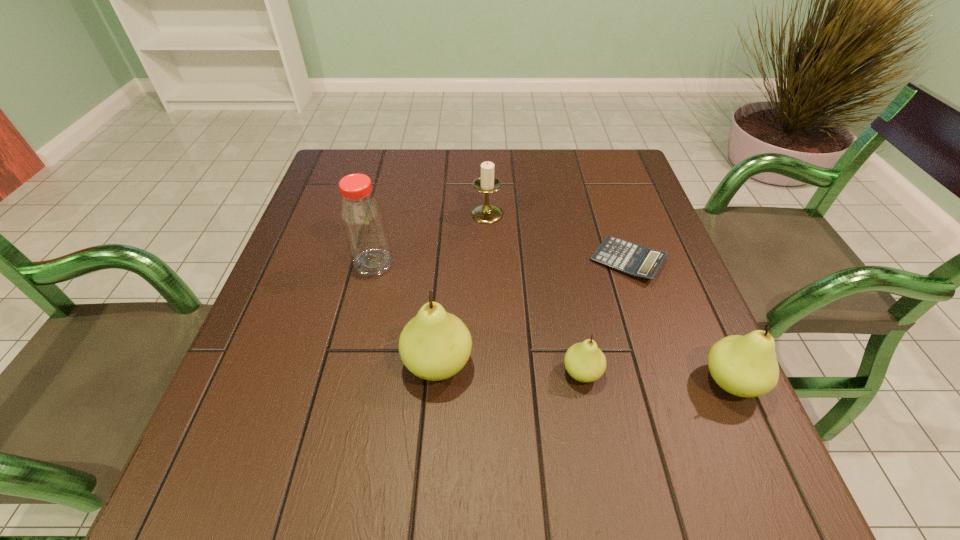
At what (x,y) coordinates should I click in order to perform the action: click on free spot located on the front of the candle holder. Please return your answer as a coordinate pair (x, y). This screenshot has height=540, width=960. Looking at the image, I should click on (488, 301).

The width and height of the screenshot is (960, 540). I want to click on free space located on the back of the shortest object, so click(x=594, y=161).

Find the location of `vacant space located on the back of the bottle`. vacant space located on the back of the bottle is located at coordinates (397, 164).

At what (x,y) coordinates should I click in order to perform the action: click on object present at the left edge. Please return your answer as a coordinate pair (x, y). Looking at the image, I should click on (363, 220).

The image size is (960, 540). What are the coordinates of `pear that is at the right edge` in the screenshot? It's located at (746, 366).

Where is `calculator that is at the right edge`? calculator that is at the right edge is located at coordinates (638, 261).

Where is `object positioned at the near right corner`? This screenshot has height=540, width=960. object positioned at the near right corner is located at coordinates (746, 366).

The width and height of the screenshot is (960, 540). In the image, there is a desktop. Identify the location of vacant space at the far edge. (406, 163).

Identify the location of free space at the near edge of the desktop. The width and height of the screenshot is (960, 540). (491, 395).

You are a GUI agent. You are given a task and a screenshot of the screen. Output one action in this format:
    pyautogui.click(x=<x>, y=<y>)
    Task: Click on the free space at the left edge of the desktop
    
    Given the screenshot: What is the action you would take?
    pyautogui.click(x=268, y=342)